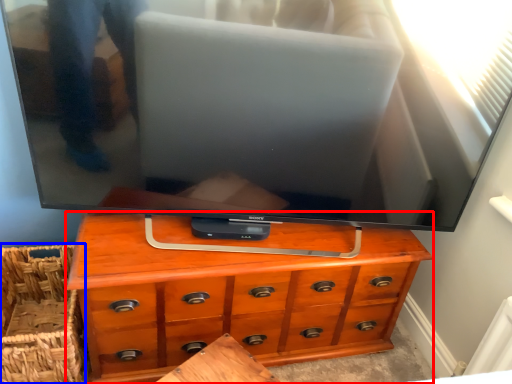
Question: Which object appears closest to the camera in this image, chest of drawers (highlighted by a red box) or basket (highlighted by a blue box)?

Choices:
 (A) chest of drawers
 (B) basket

Answer: (A)